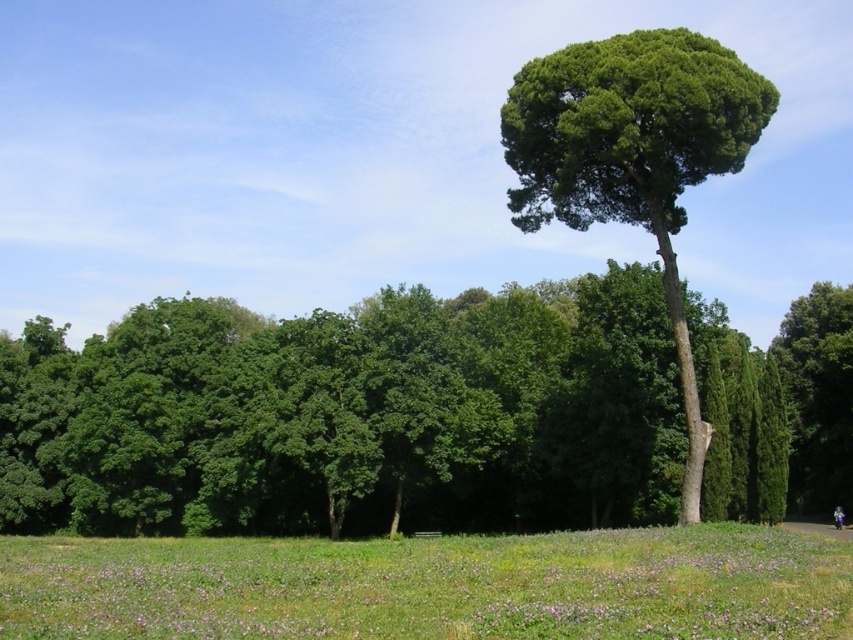
You are a hiker who wants to take a photo of the dark blue jeans at center and the green leafy tree at right. Which object should you focus on first if you want both to be in clear focus?

You should focus on the green leafy tree at right first because it is bigger than the dark blue jeans at center, so it requires more precise focusing to ensure clarity.

You are a bird looking for a place to perch. You see the green leafy tree at right and the green grass at lower center. Which location is higher and suitable for your perch?

The green leafy tree at right is taller than the green grass at lower center, so it is higher and suitable for your perch.